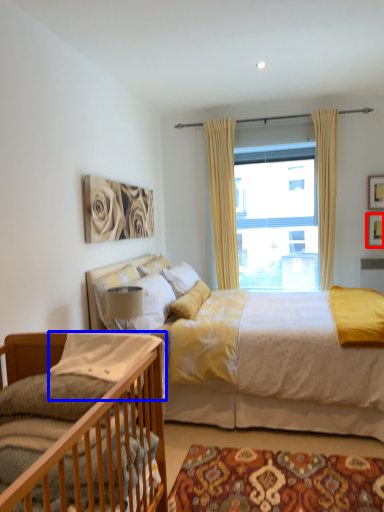
Question: Which point is further to the camera, picture frame (highlighted by a red box) or pillow (highlighted by a blue box)?

Choices:
 (A) picture frame
 (B) pillow

Answer: (A)